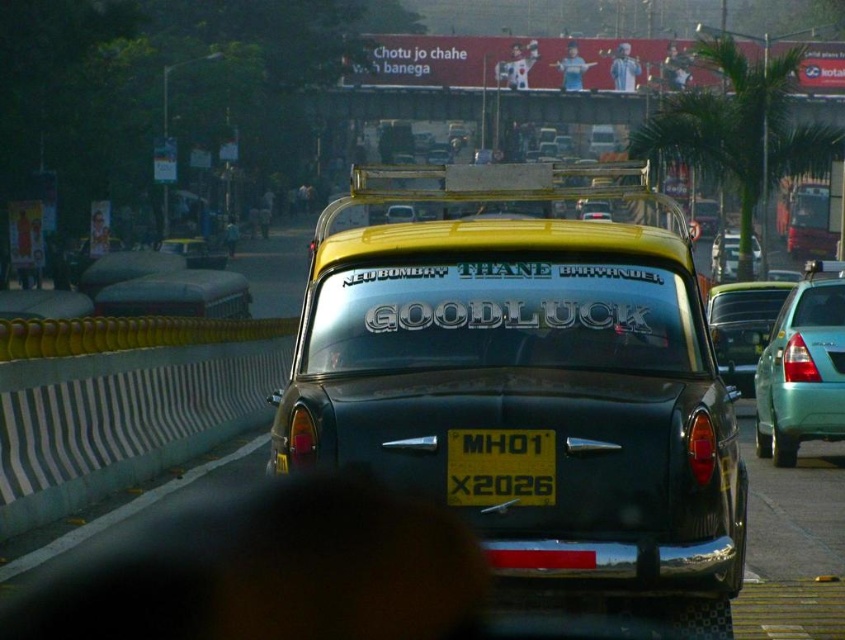
Question: Which of the following is the closest to the observer?

Choices:
 (A) green matte sedan at right
 (B) teal matte sedan at right
 (C) yellow matte license plate at center

Answer: (C)

Question: Which point is closer to the camera?

Choices:
 (A) metallic silver car at center
 (B) green matte sedan at right
 (C) shiny black taxi at center

Answer: (C)

Question: Does teal matte sedan at right lie in front of green matte sedan at right?

Choices:
 (A) no
 (B) yes

Answer: (B)

Question: Which of these objects is positioned closest to the green leafy palm tree at upper right?

Choices:
 (A) yellow matte license plate at center
 (B) matte black taxi at center
 (C) teal matte sedan at right
 (D) green matte sedan at right

Answer: (D)

Question: Can you confirm if yellow matte license plate at center is positioned above matte black taxi at center?

Choices:
 (A) no
 (B) yes

Answer: (A)

Question: Does yellow matte license plate at center have a larger size compared to metallic silver car at center?

Choices:
 (A) yes
 (B) no

Answer: (B)